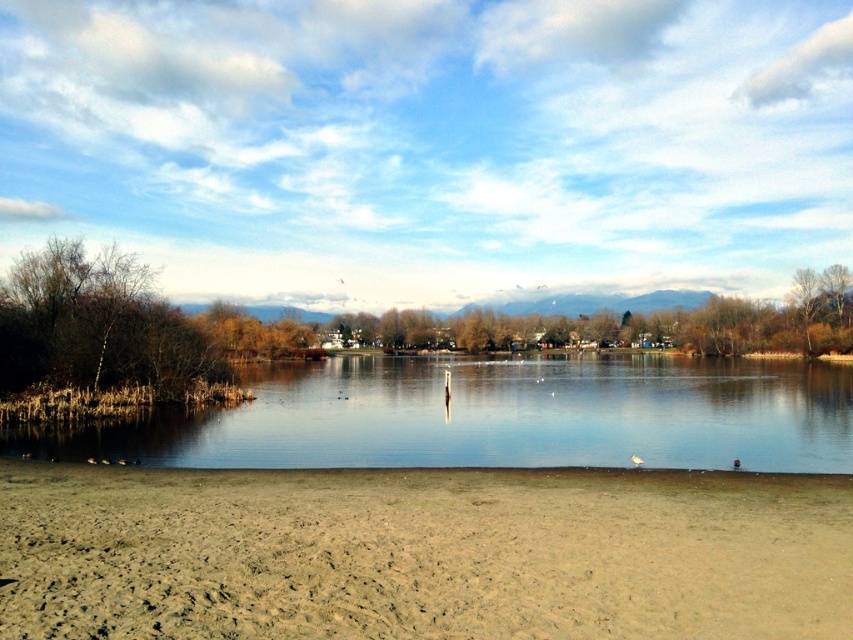
Question: Does brown sandy beach at lower center appear on the left side of clear water at center?

Choices:
 (A) no
 (B) yes

Answer: (B)

Question: Does brown sandy beach at lower center have a lesser width compared to clear water at center?

Choices:
 (A) yes
 (B) no

Answer: (A)

Question: Among these objects, which one is nearest to the camera?

Choices:
 (A) brown sandy beach at lower center
 (B) clear water at center

Answer: (A)

Question: Which point appears closest to the camera in this image?

Choices:
 (A) (254, 579)
 (B) (585, 408)

Answer: (A)

Question: Which point is farther from the camera taking this photo?

Choices:
 (A) (364, 374)
 (B) (393, 496)

Answer: (A)

Question: Does brown sandy beach at lower center lie behind clear water at center?

Choices:
 (A) no
 (B) yes

Answer: (A)